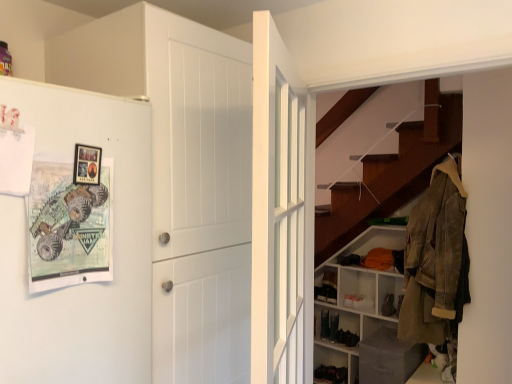
Question: Is leather jacket at right wider or thinner than black suede shoe at lower center, which is the 3th shoe in left-to-right order?

Choices:
 (A) thin
 (B) wide

Answer: (B)

Question: Considering their positions, is leather jacket at right located in front of or behind black suede shoe at lower center, arranged as the 1th shoe when viewed from the front?

Choices:
 (A) behind
 (B) front

Answer: (B)

Question: Which object is the closest to the black suede shoe at lower center, positioned as the second shoe in front-to-back order?

Choices:
 (A) white matte door at center, placed as the second door when sorted from right to left
 (B) white wooden door at center, the 2th door when ordered from left to right
 (C) white matte shelving unit at lower right, the first shelf from the back
 (D) white matte refrigerator at left
 (E) matte black shoe at lower center, which is the first shoe from left to right

Answer: (E)

Question: Considering the real-world distances, which object is closest to the black suede shoe at lower center, the third shoe viewed from the back?

Choices:
 (A) black suede shoe at lower center, positioned as the second shoe in front-to-back order
 (B) white matte shelving unit at lower right, the first shelf from the back
 (C) matte black shoe at lower center, which ranks as the third shoe in front-to-back order
 (D) white matte door at center, placed as the second door when sorted from right to left
 (E) leather jacket at right

Answer: (B)